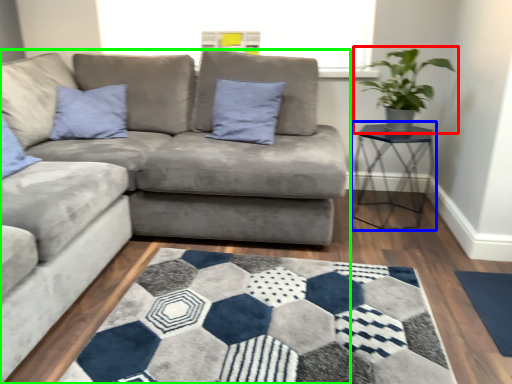
Question: Which object is the closest to the houseplant (highlighted by a red box)? Choose among these: table (highlighted by a blue box) or studio couch (highlighted by a green box).

Choices:
 (A) table
 (B) studio couch

Answer: (A)